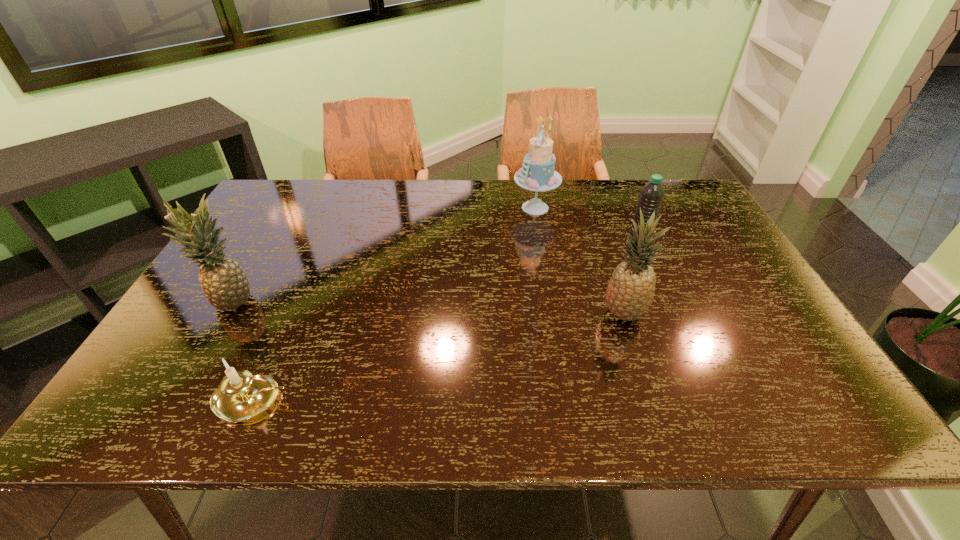
At what (x,y) coordinates should I click in order to perform the action: click on blank space that satisfies the following two spatial constraints: 1. with a ladder on the side of the rightmost object; 2. on the left side of the cake. Please return your answer as a coordinate pair (x, y). Looking at the image, I should click on (540, 240).